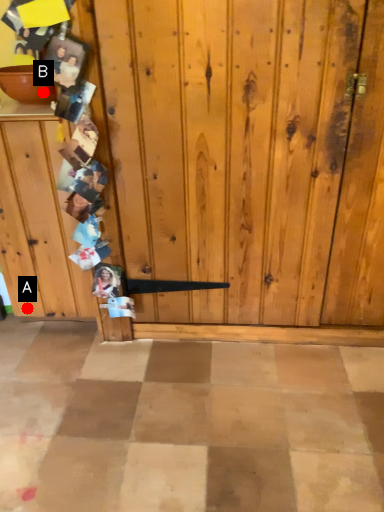
Question: Two points are circled on the image, labeled by A and B beside each circle. Among these points, which one is farthest from the camera?

Choices:
 (A) A is further
 (B) B is further

Answer: (A)